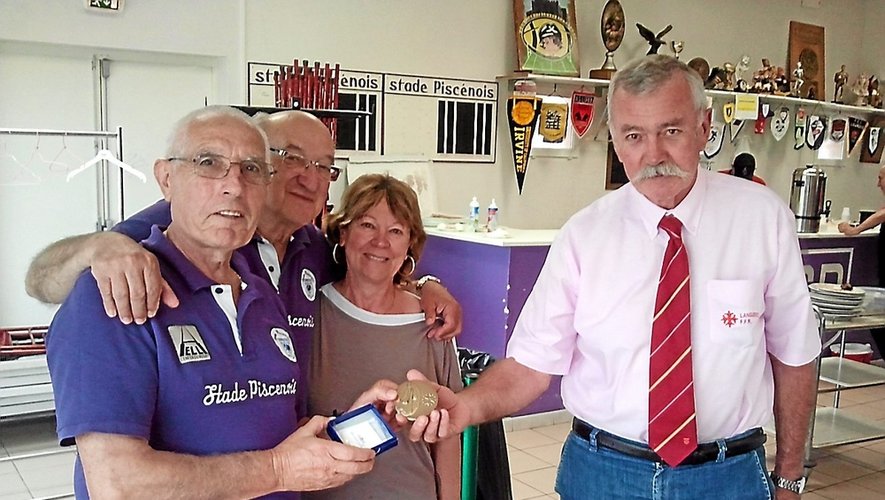
Where is `eagle trophy`? eagle trophy is located at coordinates (656, 44).